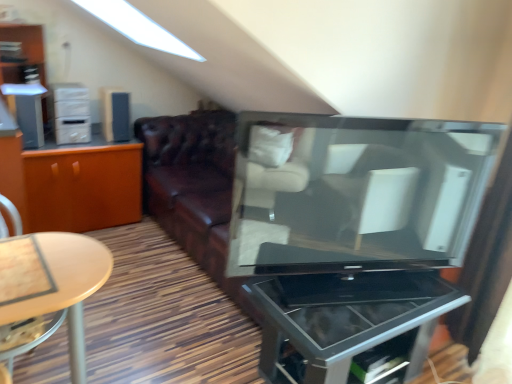
What do you see at coordinates (71, 113) in the screenshot?
I see `white plastic cabinet at left` at bounding box center [71, 113].

Find the location of a particular element. The width and height of the screenshot is (512, 384). satin silver speaker at left, which is the 1th appliance in front-to-back order is located at coordinates pos(27,111).

The height and width of the screenshot is (384, 512). Describe the element at coordinates (349, 325) in the screenshot. I see `metallic glass tv stand at center` at that location.

Locate an element on the screen. The width and height of the screenshot is (512, 384). matte black television at center is located at coordinates (358, 194).

What are the coordinates of `white plastic cabinet at left` in the screenshot? It's located at [x=71, y=113].

From the image's perspective, is matte white dresser at upper left located above or below metallic glass tv stand at center?

From the image's perspective, matte white dresser at upper left appears above metallic glass tv stand at center.

Is matte white dresser at upper left facing towards metallic glass tv stand at center?

No, matte white dresser at upper left is not aimed at metallic glass tv stand at center.

Can you tell me how much matte white dresser at upper left and metallic glass tv stand at center differ in facing direction?

There is a 0.0688-degree angle between the facing directions of matte white dresser at upper left and metallic glass tv stand at center.

Can you confirm if matte white dresser at upper left is positioned to the right of metallic glass tv stand at center?

No, matte white dresser at upper left is not to the right of metallic glass tv stand at center.

From the picture: Which of these two, satin black speaker at upper left, the first appliance from the right, or white plastic cabinet at left, stands shorter?

With less height is satin black speaker at upper left, the first appliance from the right.

Which object is positioned more to the left, satin black speaker at upper left, the first appliance from the back, or white plastic cabinet at left?

white plastic cabinet at left is more to the left.

Consider the image. Which object is closer to the camera taking this photo, satin black speaker at upper left, positioned as the 2th appliance in front-to-back order, or white plastic cabinet at left?

white plastic cabinet at left is more forward.

Is orange wood cabinet at left surrounded by matte white dresser at upper left?

Actually, orange wood cabinet at left is outside matte white dresser at upper left.

Measure the distance from matte white dresser at upper left to orange wood cabinet at left.

A distance of 83.27 centimeters exists between matte white dresser at upper left and orange wood cabinet at left.

Which of these two, matte white dresser at upper left or orange wood cabinet at left, stands taller?

matte white dresser at upper left is taller.

Does point (35, 60) come behind point (130, 167)?

No, it is in front of (130, 167).

Is satin black speaker at upper left, arranged as the 2th appliance when viewed from the left, aimed at orange wood cabinet at left?

No, satin black speaker at upper left, arranged as the 2th appliance when viewed from the left, does not turn towards orange wood cabinet at left.

Is point (119, 123) in front of point (106, 183)?

Yes.

In the image, is satin black speaker at upper left, arranged as the 2th appliance when viewed from the left, positioned in front of or behind orange wood cabinet at left?

In the image, satin black speaker at upper left, arranged as the 2th appliance when viewed from the left, appears behind orange wood cabinet at left.

Can you confirm if satin black speaker at upper left, the first appliance from the right, is wider than orange wood cabinet at left?

No.

Based on their sizes in the image, would you say satin silver speaker at left, positioned as the 2th appliance in back-to-front order, is bigger or smaller than matte white dresser at upper left?

satin silver speaker at left, positioned as the 2th appliance in back-to-front order, is smaller than matte white dresser at upper left.

From the image's perspective, relative to matte white dresser at upper left, is satin silver speaker at left, which is the 1th appliance in front-to-back order, above or below?

From the image's perspective, satin silver speaker at left, which is the 1th appliance in front-to-back order, appears below matte white dresser at upper left.

Could you tell me if satin silver speaker at left, which is the 1th appliance in front-to-back order, is turned towards matte white dresser at upper left?

No, satin silver speaker at left, which is the 1th appliance in front-to-back order, is not oriented towards matte white dresser at upper left.

Can we say satin silver speaker at left, which is the 1th appliance in front-to-back order, lies outside matte white dresser at upper left?

Yes, satin silver speaker at left, which is the 1th appliance in front-to-back order, is not within matte white dresser at upper left.

Would you consider matte black television at center to be distant from orange wood cabinet at left?

That's right, there is a large distance between matte black television at center and orange wood cabinet at left.

How much distance is there between matte black television at center and orange wood cabinet at left?

5.25 feet.

In terms of height, does matte black television at center look taller or shorter compared to orange wood cabinet at left?

Clearly, matte black television at center is taller compared to orange wood cabinet at left.

Does matte black television at center come behind orange wood cabinet at left?

No, the depth of matte black television at center is less than that of orange wood cabinet at left.

Is white plastic cabinet at left positioned with its back to satin silver speaker at left, arranged as the second appliance when viewed from the right?

That's not correct — white plastic cabinet at left is not looking away from satin silver speaker at left, arranged as the second appliance when viewed from the right.

Is white plastic cabinet at left in contact with satin silver speaker at left, arranged as the second appliance when viewed from the right?

No, white plastic cabinet at left is not next to satin silver speaker at left, arranged as the second appliance when viewed from the right.

Is satin silver speaker at left, which is counted as the 1th appliance, starting from the left, surrounded by white plastic cabinet at left?

No, satin silver speaker at left, which is counted as the 1th appliance, starting from the left, is not inside white plastic cabinet at left.

This screenshot has height=384, width=512. Find the location of `dresser behind the metallic glass tv stand at center`. dresser behind the metallic glass tv stand at center is located at coordinates (27, 43).

You are a GUI agent. You are given a task and a screenshot of the screen. Output one action in this format:
    pyautogui.click(x=<x>, y=<y>)
    Task: Click on the tv cabinet on the left of satin black speaker at upper left, the first appliance from the right
    Image resolution: width=512 pixels, height=384 pixels.
    Given the screenshot: What is the action you would take?
    pyautogui.click(x=71, y=113)

Considering their positions, is matte white dresser at upper left positioned further to metallic glass tv stand at center than satin silver speaker at left, which is counted as the 1th appliance, starting from the left?

Based on the image, matte white dresser at upper left appears to be further to metallic glass tv stand at center.

When comparing their distances from satin black speaker at upper left, positioned as the 2th appliance in front-to-back order, does orange wood cabinet at left or matte white dresser at upper left seem further?

Answer: Among the two, matte white dresser at upper left is located further to satin black speaker at upper left, positioned as the 2th appliance in front-to-back order.

Considering their positions, is white plastic cabinet at left positioned closer to matte white dresser at upper left than metallic glass tv stand at center?

white plastic cabinet at left is closer to matte white dresser at upper left.

Looking at the image, which one is located closer to satin black speaker at upper left, positioned as the 2th appliance in front-to-back order, matte black television at center or satin silver speaker at left, arranged as the second appliance when viewed from the right?

satin silver speaker at left, arranged as the second appliance when viewed from the right, is closer to satin black speaker at upper left, positioned as the 2th appliance in front-to-back order.

From the image, which object appears to be nearer to satin black speaker at upper left, the first appliance from the back, metallic glass tv stand at center or orange wood cabinet at left?

Based on the image, orange wood cabinet at left appears to be nearer to satin black speaker at upper left, the first appliance from the back.

Which object lies nearer to the anchor point orange wood cabinet at left, matte black television at center or matte white dresser at upper left?

The object closer to orange wood cabinet at left is matte white dresser at upper left.

Based on the photo, considering their positions, is satin black speaker at upper left, the first appliance from the back, positioned closer to matte black television at center than metallic glass tv stand at center?

metallic glass tv stand at center is positioned closer to the anchor matte black television at center.

Looking at the image, which one is located further to metallic glass tv stand at center, satin black speaker at upper left, arranged as the 2th appliance when viewed from the left, or white plastic cabinet at left?

Among the two, white plastic cabinet at left is located further to metallic glass tv stand at center.

Find the location of `tv cabinet between orange wood cabinet at left and metallic glass tv stand at center from left to right`. tv cabinet between orange wood cabinet at left and metallic glass tv stand at center from left to right is located at coordinates [71, 113].

You are a GUI agent. You are given a task and a screenshot of the screen. Output one action in this format:
    pyautogui.click(x=<x>, y=<y>)
    Task: Click on the appliance between white plastic cabinet at left and metallic glass tv stand at center from left to right
    
    Given the screenshot: What is the action you would take?
    pyautogui.click(x=116, y=115)

Find the location of `tv cabinet between matte white dresser at upper left and metallic glass tv stand at center in the horizontal direction`. tv cabinet between matte white dresser at upper left and metallic glass tv stand at center in the horizontal direction is located at coordinates (x=71, y=113).

At what (x,y) coordinates should I click in order to perform the action: click on tv cabinet located between satin silver speaker at left, positioned as the 2th appliance in back-to-front order, and matte black television at center in the left-right direction. Please return your answer as a coordinate pair (x, y). Looking at the image, I should click on (71, 113).